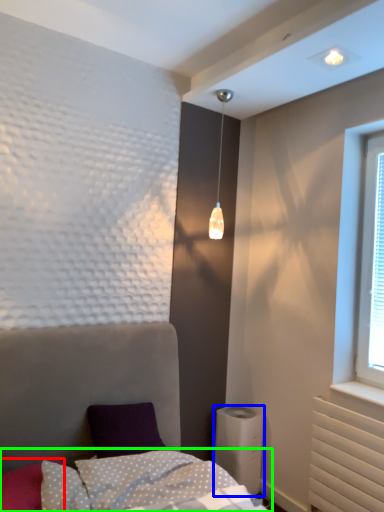
Question: Which object is positioned farthest from pillow (highlighted by a red box)? Select from air conditioning (highlighted by a blue box) and bedding (highlighted by a green box).

Choices:
 (A) air conditioning
 (B) bedding

Answer: (A)